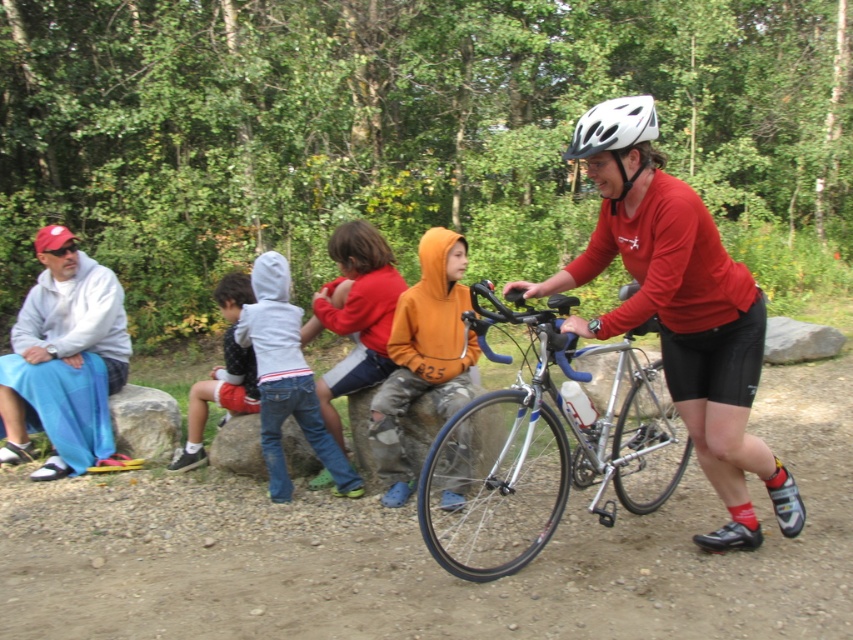
Question: Does orange hoodie at center have a larger size compared to white matte bicycle helmet at upper center?

Choices:
 (A) no
 (B) yes

Answer: (B)

Question: Does dirt track at center appear over orange hoodie at center?

Choices:
 (A) no
 (B) yes

Answer: (A)

Question: Based on their relative distances, which object is farther from the dirt track at center?

Choices:
 (A) dark gray hoodie at center
 (B) orange fleece jacket at center
 (C) orange hoodie at center

Answer: (A)

Question: Can you confirm if dirt track at center is positioned to the right of light gray fleece jacket at left?

Choices:
 (A) yes
 (B) no

Answer: (A)

Question: Based on their relative distances, which object is farther from the dirt track at center?

Choices:
 (A) light gray fleece jacket at left
 (B) white matte bicycle helmet at upper center
 (C) dark gray hoodie at center

Answer: (B)

Question: Which of the following is the farthest from the observer?

Choices:
 (A) (482, 493)
 (B) (451, 252)
 (C) (398, 592)
 (D) (367, 252)

Answer: (D)